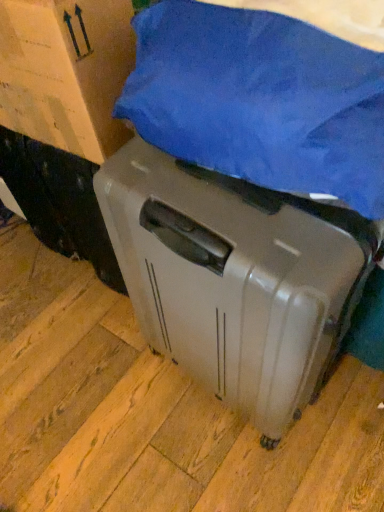
What do you see at coordinates (236, 278) in the screenshot?
I see `satin silver suitcase at center` at bounding box center [236, 278].

Identify the location of satin silver suitcase at center. This screenshot has width=384, height=512. (236, 278).

I want to click on satin silver suitcase at center, so click(x=236, y=278).